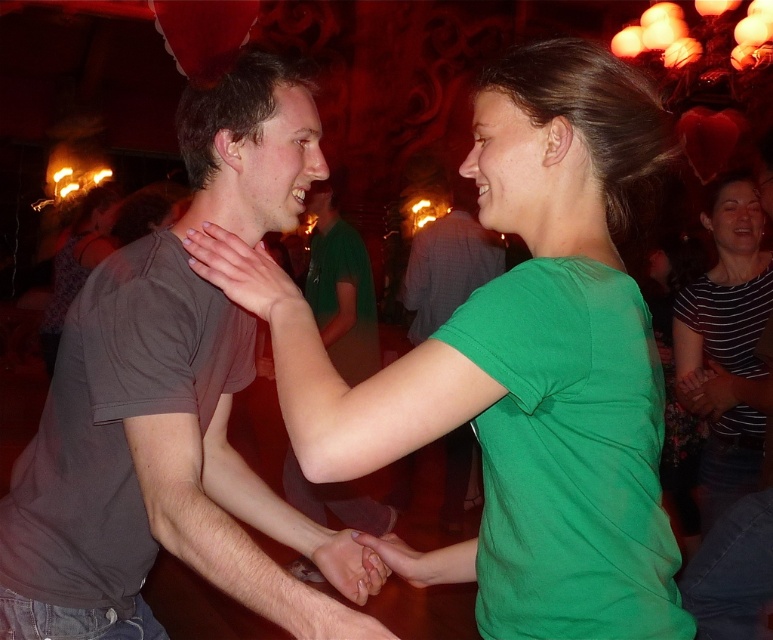
Is the position of smooth skin hand at center less distant than that of matte green hand at center?

That is True.

Who is higher up, smooth skin hand at center or matte green hand at center?

smooth skin hand at center

At what (x,y) coordinates should I click in order to perform the action: click on smooth skin hand at center. Please return your answer as a coordinate pair (x, y). The image size is (773, 640). Looking at the image, I should click on (240, 269).

Is green matte shirt at center below matte green hand at center?

No, green matte shirt at center is not below matte green hand at center.

Does point (571, 381) lie in front of point (346, 572)?

Yes, it is in front of point (346, 572).

Where is `green matte shirt at center`? green matte shirt at center is located at coordinates (530, 368).

Can you confirm if gray matte t-shirt at left is positioned above matte gray shirt at center?

Result: No, gray matte t-shirt at left is not above matte gray shirt at center.

Who is positioned more to the left, gray matte t-shirt at left or matte gray shirt at center?

matte gray shirt at center

Who is more forward, [22,541] or [356,326]?

Point [22,541] is in front.

This screenshot has width=773, height=640. Identify the location of gray matte t-shirt at left. (167, 401).